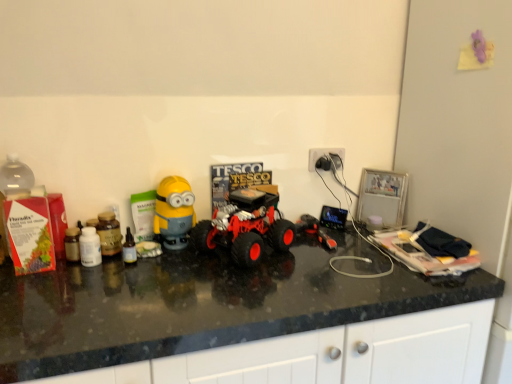
Locate an element on the screen. free space to the left of translucent glass bottle at center is located at coordinates (74, 272).